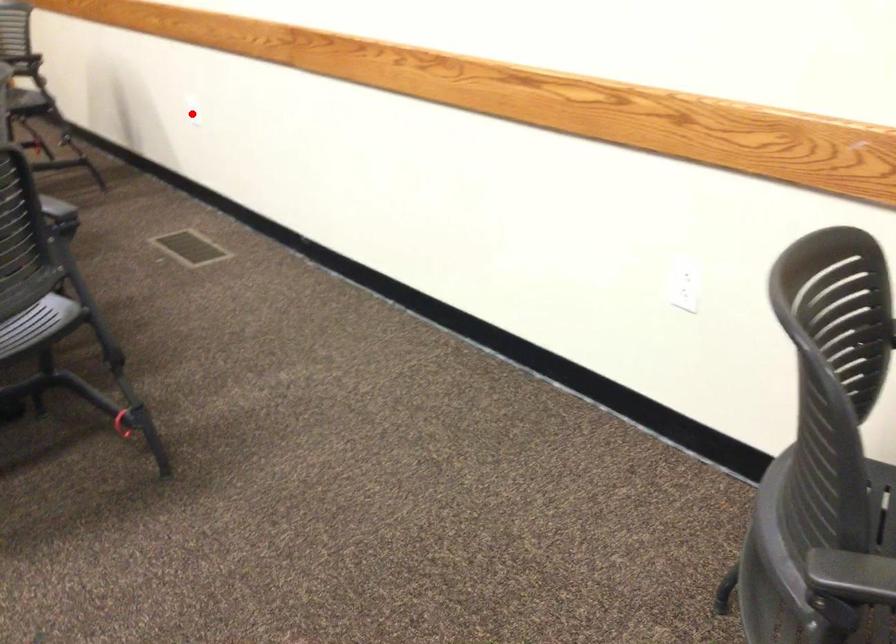
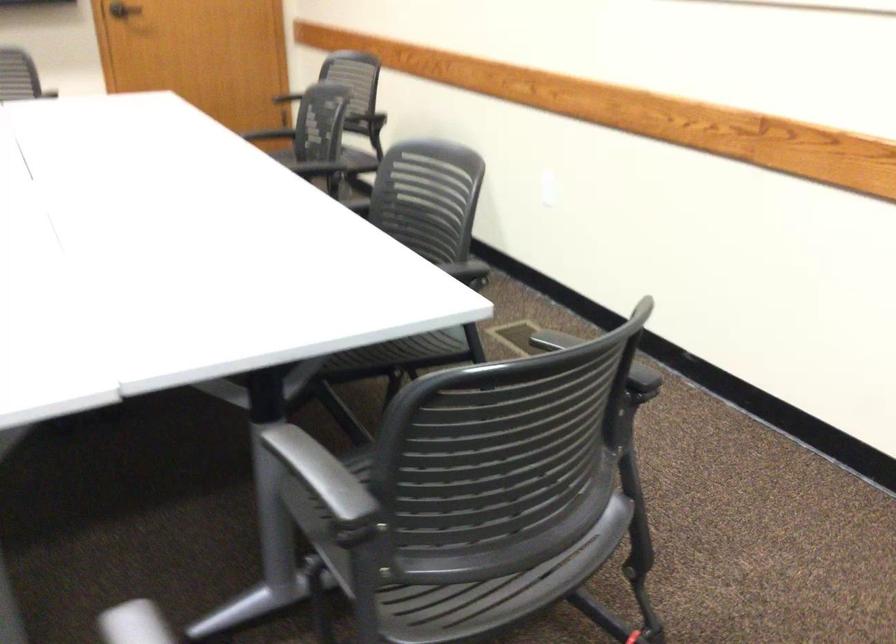
Where in the second image is the point corresponding to the highlighted location from the first image?

(547, 196)